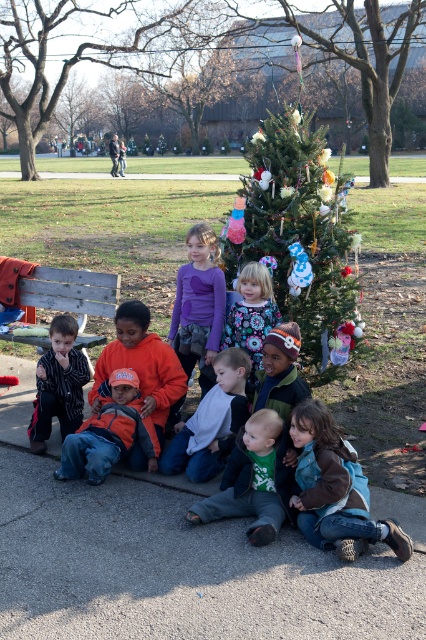
Which is in front, point (379, 104) or point (339, 509)?

Positioned in front is point (339, 509).

Who is higher up, green textured christmas tree at center or brown fuzzy jacket at lower right?

green textured christmas tree at center is higher up.

Find the location of a particular element. This screenshot has width=426, height=640. green textured christmas tree at center is located at coordinates (163, 49).

Is wooden bench at left thinner than striped cotton shirt at left?

No.

Is point (72, 269) farther from viewer compared to point (34, 429)?

That is True.

Find the location of a particular element. This screenshot has width=426, height=640. wooden bench at left is located at coordinates (71, 296).

Is orange fleece jacket at center thinner than wooden bench at left?

Indeed, orange fleece jacket at center has a lesser width compared to wooden bench at left.

Between orange fleece jacket at center and wooden bench at left, which one has less height?

wooden bench at left is shorter.

This screenshot has width=426, height=640. In order to click on orange fleece jacket at center in this screenshot , I will do (x=141, y=364).